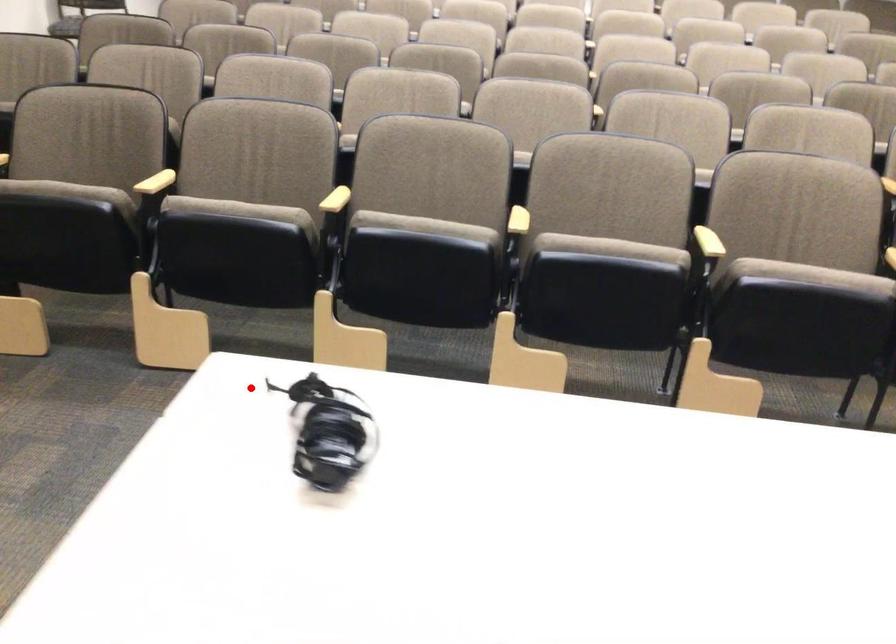
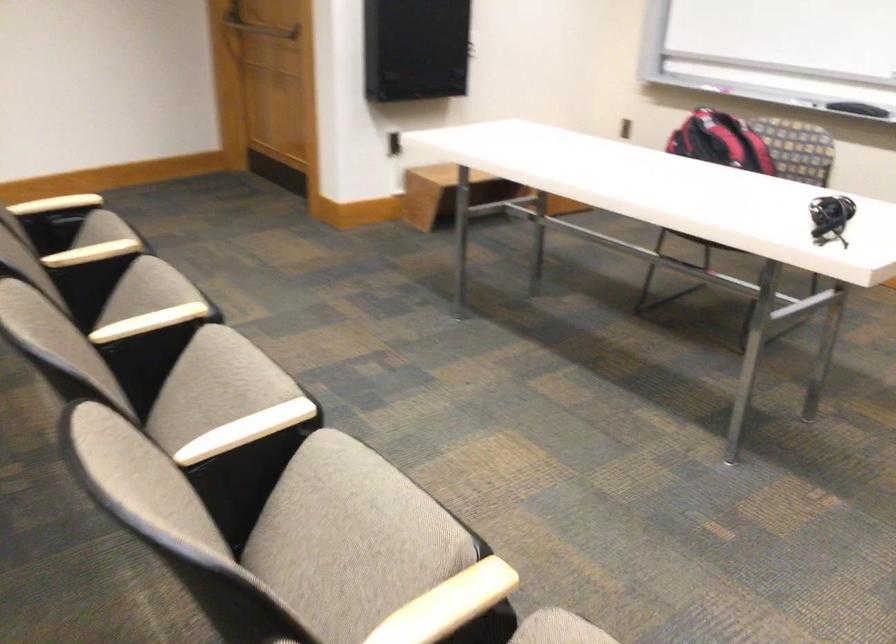
Question: I am providing you with two images of the same scene from different viewpoints. Given a red point in image1, look at the same physical point in image2. Is it:

Choices:
 (A) Closer to the viewpoint
 (B) Farther from the viewpoint

Answer: (B)